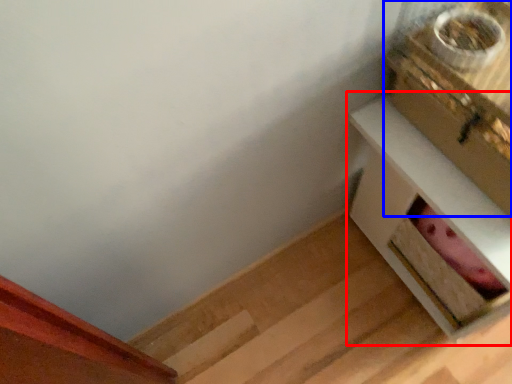
Question: Which of the following is the closest to the observer, table (highlighted by a red box) or box (highlighted by a blue box)?

Choices:
 (A) table
 (B) box

Answer: (B)